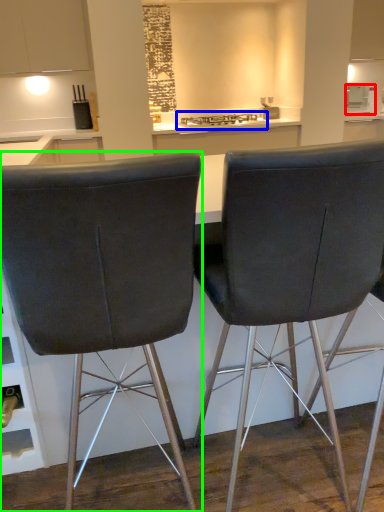
Question: Which object is the farthest from appliance (highlighted by a red box)? Choose among these: gas stove (highlighted by a blue box) or chair (highlighted by a green box).

Choices:
 (A) gas stove
 (B) chair

Answer: (B)